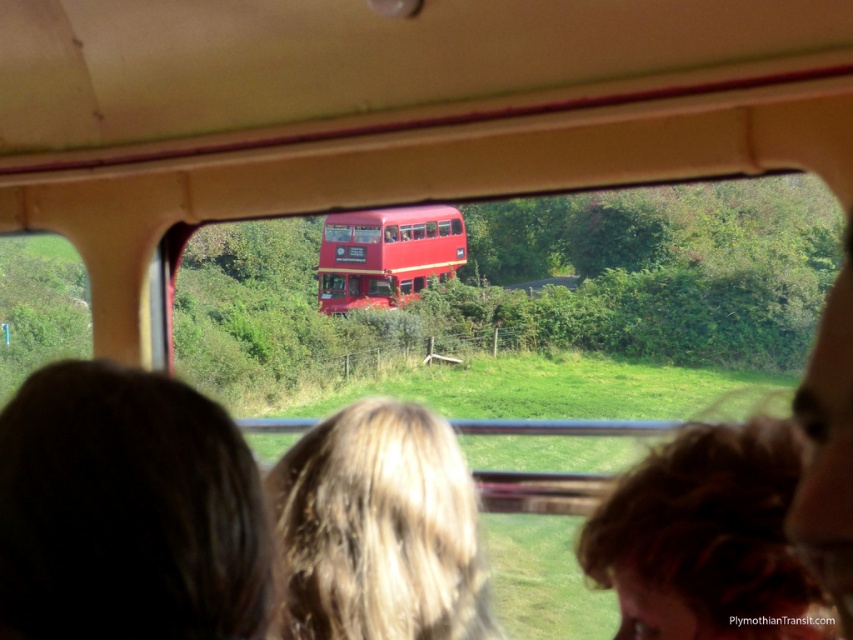
You are a passenger sitting in the vehicle and looking out the window. You notice two people with blonde hair at center and blonde hair at lower center. Which one is closer to you?

The blonde hair at center is closer to you because it is in front of the blonde hair at lower center.

You are inside a vehicle and looking through the window. You see two points marked on the window. The first point is at coordinates point (286,580) and the second point is at point (749,486). Which point is closer to you?

Point (286,580) is further to the camera than point (749,486), so the point closer to you is point (749,486).

You are a passenger sitting in the train and looking out the window. You see the blonde hair at center and the shiny red bus at center. Which object is closer to the window?

The shiny red bus at center is closer to the window than the blonde hair at center because the blonde hair at center is positioned on the right side of the shiny red bus at center.